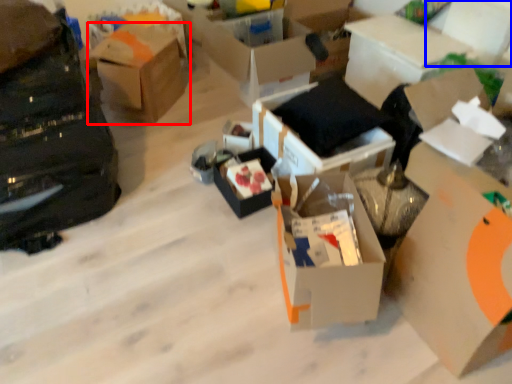
Question: Which point is further to the camera, box (highlighted by a red box) or storage box (highlighted by a blue box)?

Choices:
 (A) box
 (B) storage box

Answer: (A)